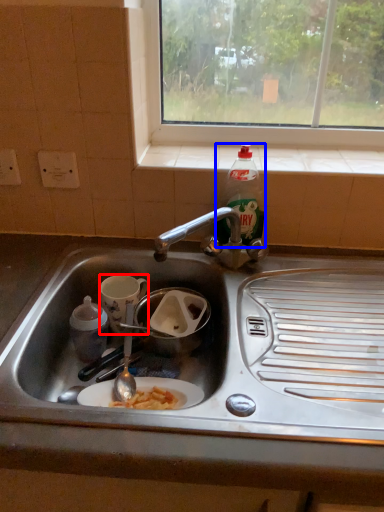
Question: Among these objects, which one is farthest to the camera, coffee cup (highlighted by a red box) or bottle (highlighted by a blue box)?

Choices:
 (A) coffee cup
 (B) bottle

Answer: (A)